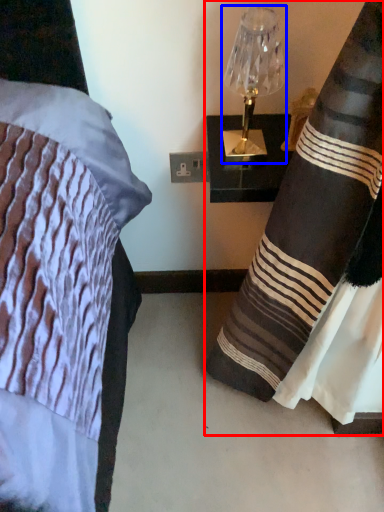
Question: Which point is closer to the camera, curtain (highlighted by a red box) or lamp (highlighted by a blue box)?

Choices:
 (A) curtain
 (B) lamp

Answer: (A)